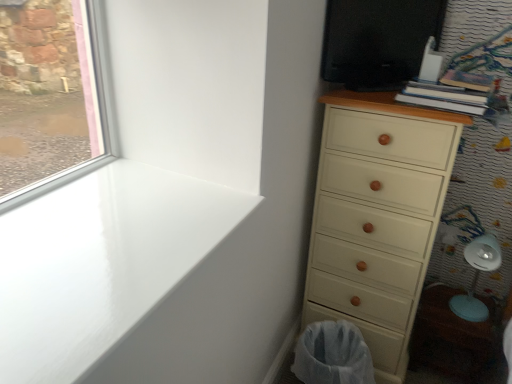
At what (x,y) coordinates should I click in order to perform the action: click on vacant space behind white plastic swivel chair at lower right. Please return your answer as a coordinate pair (x, y). This screenshot has height=384, width=512. Looking at the image, I should click on (449, 290).